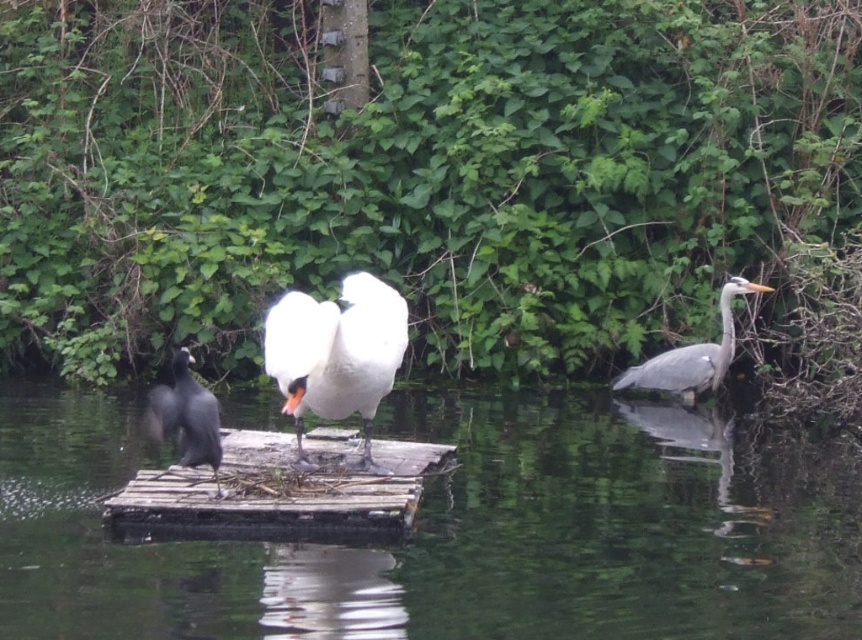
Question: Is the position of clear water at center more distant than that of gray matte heron at right?

Choices:
 (A) no
 (B) yes

Answer: (A)

Question: From the image, what is the correct spatial relationship of clear water at center in relation to black glossy bird at left?

Choices:
 (A) below
 (B) above

Answer: (A)

Question: Which object is closer to the camera taking this photo?

Choices:
 (A) clear water at center
 (B) black glossy bird at left
 (C) white feathered swan at center
 (D) gray matte heron at right

Answer: (A)

Question: Which point appears farthest from the camera in this image?

Choices:
 (A) (678, 371)
 (B) (679, 616)

Answer: (A)

Question: Can you confirm if clear water at center is positioned above gray matte heron at right?

Choices:
 (A) no
 (B) yes

Answer: (A)

Question: Which of the following is the closest to the observer?

Choices:
 (A) (644, 372)
 (B) (195, 428)
 (C) (380, 310)
 (D) (734, 470)

Answer: (B)